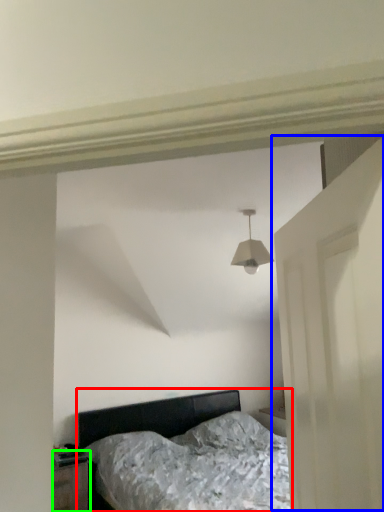
Question: Which object is the closest to the bed (highlighted by a red box)? Choose among these: door (highlighted by a blue box) or nightstand (highlighted by a green box).

Choices:
 (A) door
 (B) nightstand

Answer: (B)